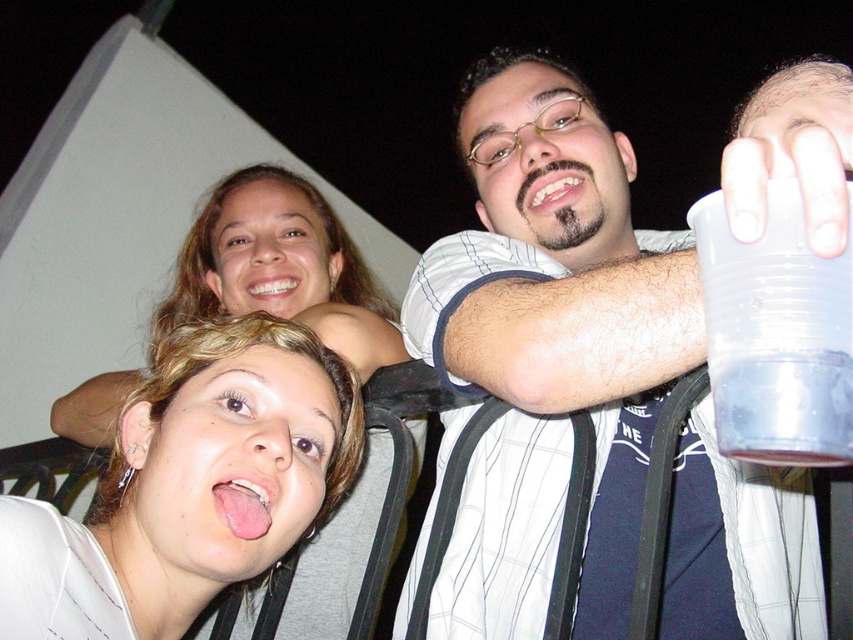
Who is more forward, (770, 100) or (229, 481)?

Positioned in front is point (770, 100).

You are a GUI agent. You are given a task and a screenshot of the screen. Output one action in this format:
    pyautogui.click(x=<x>, y=<y>)
    Task: Click on the white striped shirt at upper center
    The image size is (853, 640).
    Given the screenshot: What is the action you would take?
    [548, 346]

Who is positioned more to the right, smooth skin face at upper center or pink flesh tongue at lower center?

Positioned to the right is pink flesh tongue at lower center.

Measure the distance between point (228, 296) and camera.

A distance of 4.77 feet exists between point (228, 296) and camera.

Find the location of a particular element. This screenshot has height=640, width=853. smooth skin face at upper center is located at coordinates click(280, 268).

In the scene shown: Which is more to the right, white striped shirt at upper center or transparent plastic cup at upper right?

Positioned to the right is white striped shirt at upper center.

Find the location of `white striped shirt at upper center`. white striped shirt at upper center is located at coordinates (548, 346).

Where is `white striped shirt at upper center`? white striped shirt at upper center is located at coordinates (548, 346).